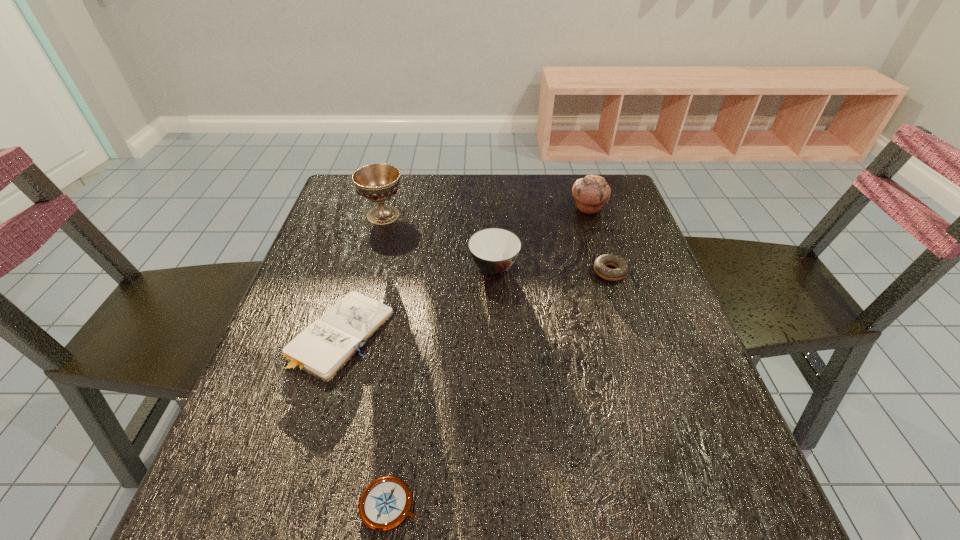
Identify the location of vacant space located 0.230m on the left of the muffin. (490, 208).

Image resolution: width=960 pixels, height=540 pixels. I want to click on vacant space located on the back of the third object from right to left, so click(x=493, y=238).

Image resolution: width=960 pixels, height=540 pixels. Identify the location of blank space located 0.210m on the left of the fourth tallest object. (506, 272).

You are a GUI agent. You are given a task and a screenshot of the screen. Output one action in this format:
    pyautogui.click(x=<x>, y=<y>)
    Task: Click on the vacant space situated on the back of the notebook
    
    Given the screenshot: What is the action you would take?
    pyautogui.click(x=371, y=233)

Identify the location of free space located on the back of the nearest object. The width and height of the screenshot is (960, 540). (418, 309).

The height and width of the screenshot is (540, 960). Identify the location of chalice located in the far edge section of the desktop. (377, 182).

You are a GUI agent. You are given a task and a screenshot of the screen. Output one action in this format:
    pyautogui.click(x=<x>, y=<y>)
    Task: Click on the muffin that is at the far edge
    
    Given the screenshot: What is the action you would take?
    pyautogui.click(x=591, y=193)

Identify the location of object located at the near edge. (385, 503).

Find the location of `chalice at the left edge`. chalice at the left edge is located at coordinates (377, 182).

You are a GUI agent. You are given a task and a screenshot of the screen. Output one action in this format:
    pyautogui.click(x=<x>, y=<y>)
    Task: Click on the notebook present at the left edge
    The width and height of the screenshot is (960, 540).
    Given the screenshot: What is the action you would take?
    pyautogui.click(x=325, y=346)